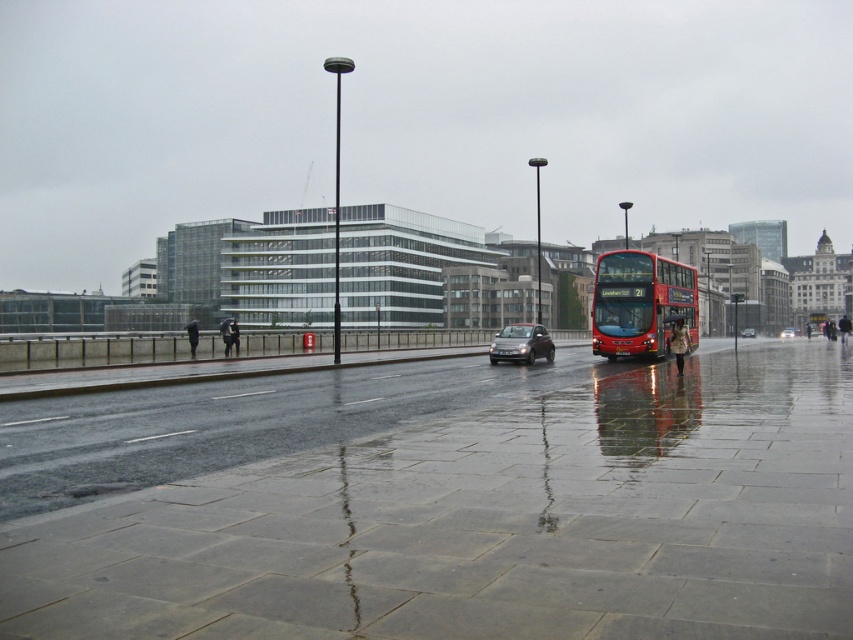
Question: In this image, where is shiny metallic hatchback at center located relative to shiny silver car at center?

Choices:
 (A) above
 (B) below

Answer: (A)

Question: Which of the following is the farthest from the observer?

Choices:
 (A) (498, 337)
 (B) (633, 355)
 (C) (744, 337)
 (D) (764, 310)

Answer: (D)

Question: Which of these objects is positioned farthest from the red metallic bus at center?

Choices:
 (A) shiny metallic hatchback at center
 (B) shiny black car at center
 (C) metallic bus stop at center

Answer: (C)

Question: Can you confirm if shiny metallic hatchback at center is smaller than metallic bus stop at center?

Choices:
 (A) yes
 (B) no

Answer: (A)

Question: Does red metallic bus at center have a smaller size compared to metallic bus stop at center?

Choices:
 (A) no
 (B) yes

Answer: (B)

Question: Based on their relative distances, which object is farther from the red metallic bus at center?

Choices:
 (A) shiny silver car at center
 (B) shiny metallic hatchback at center

Answer: (A)